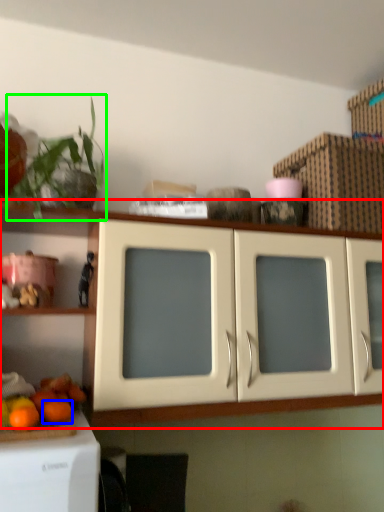
Question: Which is farther away from cabinetry (highlighted by a red box)? orange (highlighted by a blue box) or plant (highlighted by a green box)?

Choices:
 (A) orange
 (B) plant

Answer: (A)